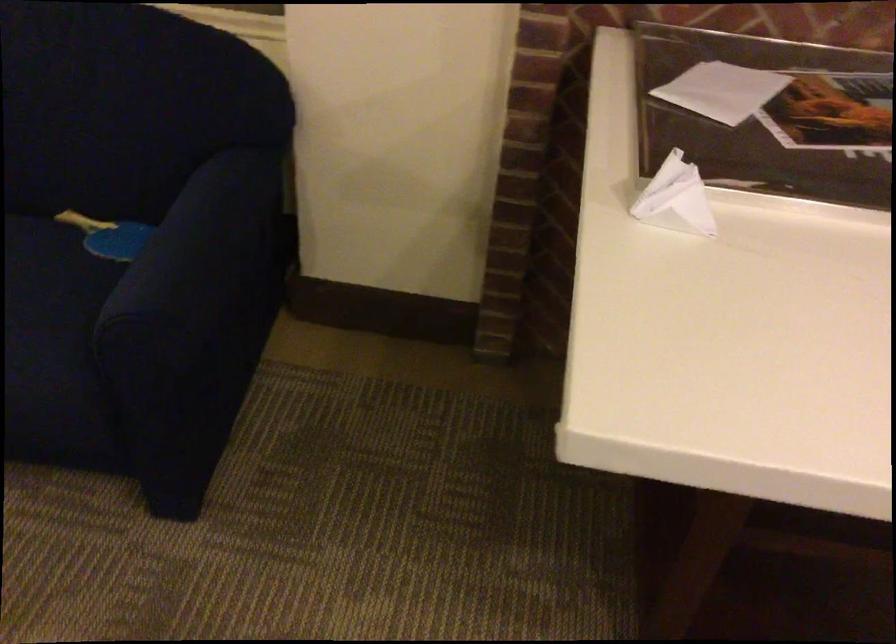
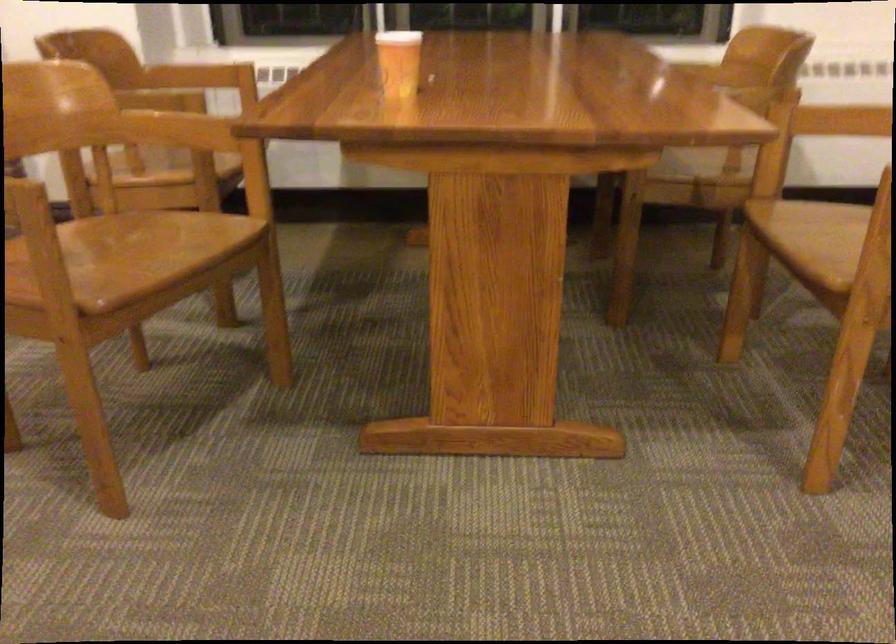
Question: Which direction would the cameraman need to move to produce the second image? Reply with the corresponding letter.

Choices:
 (A) Left
 (B) Right
 (C) Forward
 (D) Backward

Answer: (B)